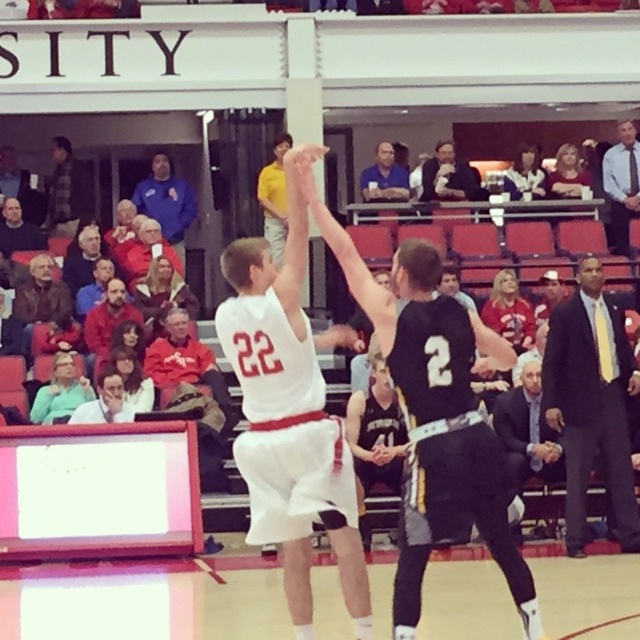
You are a photographer at the gymnasium and want to capture a photo of both the dark suit at right and the yellow shirt at center. Which object should you adjust your camera focus to first to ensure both are in frame?

The dark suit at right is wider than the yellow shirt at center, so you should adjust your camera focus to include the dark suit at right first as it requires more space in the frame.

You are a spectator in the gymnasium and want to take a photo of the two points marked in the image. Which point, point [422,406] or point [602,440], will appear larger in your photo?

Point [422,406] will appear larger in the photo because it is closer to the viewer than point [602,440].

You are a photographer standing in the gymnasium. You need to take a photo of the dark suit at right and the yellow shirt at center. Which one should you focus on first if you want to capture both in the same frame without moving the camera?

You should focus on the yellow shirt at center first because it is closer to the camera than the dark suit at right, which is further away. This way, both will be in focus when using a single focal point.